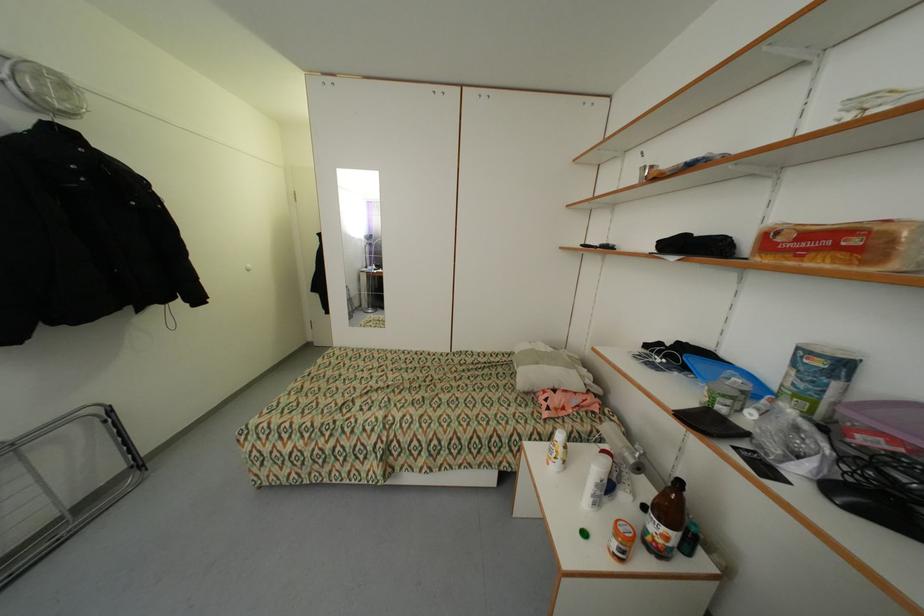
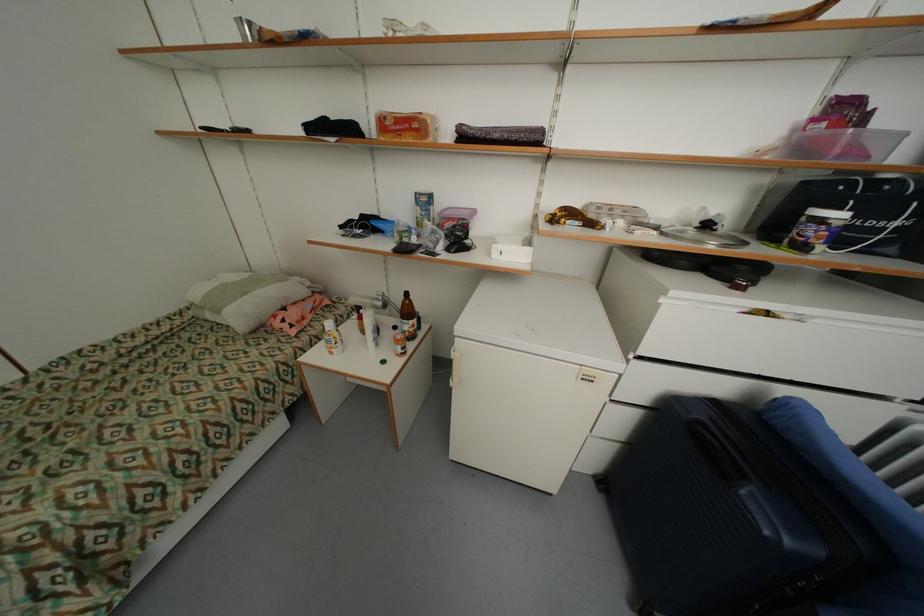
In the second image, find the point that corresponds to point (585, 421) in the first image.

(327, 320)